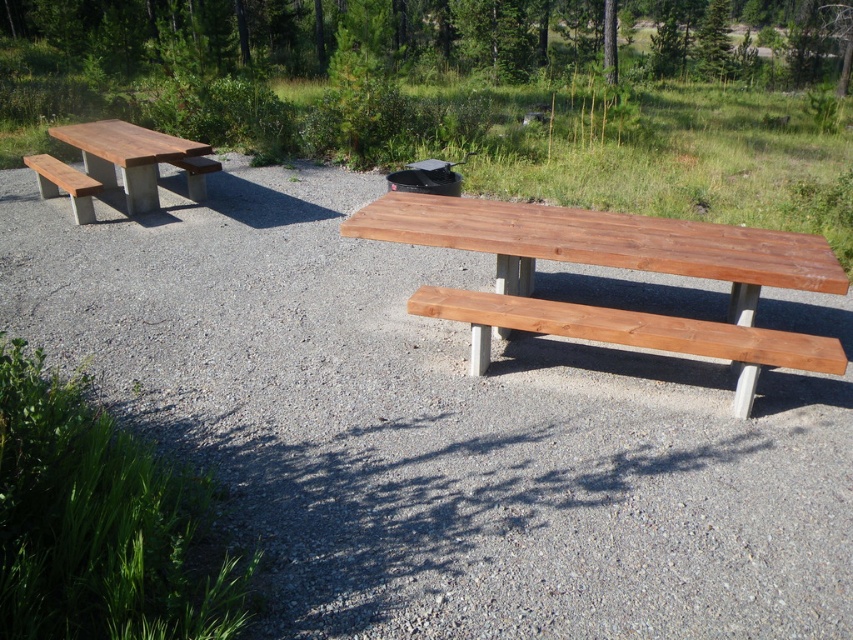
You are planning to set up a small tent between the green leafy tree at upper center and the shiny brown wood picnic table at center. Given that the tent requires 10 meters of space, will there be enough room?

The green leafy tree at upper center is 12.12 meters away from the shiny brown wood picnic table at center, so yes, there is enough space to set up the tent between them as the distance is greater than the required 10 meters.

You are planning to set up a small tent between the shiny brown wood picnic table at center and the matte wood picnic table at left. Considering their heights, which table will have its top surface higher than the other when the tent is placed in between?

The shiny brown wood picnic table at center is taller than the matte wood picnic table at left, so its top surface will be higher than the matte wood picnic table at left.